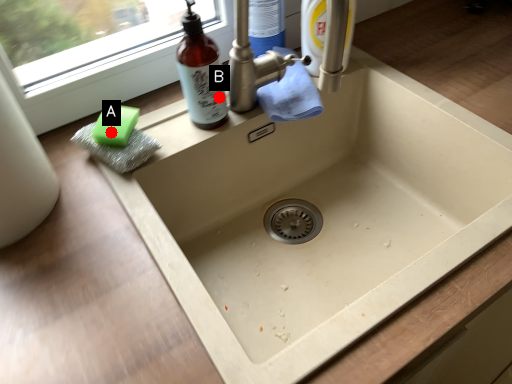
Question: Two points are circled on the image, labeled by A and B beside each circle. Which of the following is the closest to the observer?

Choices:
 (A) A is closer
 (B) B is closer

Answer: (A)